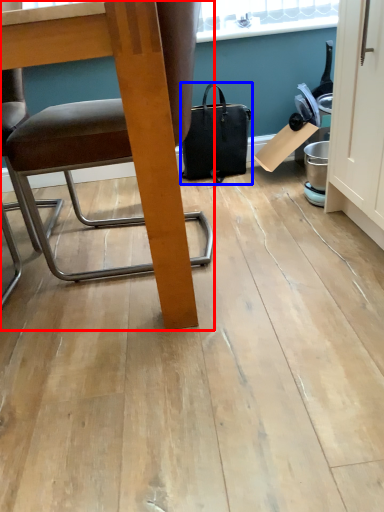
Question: Among these objects, which one is nearest to the camera, chair (highlighted by a red box) or handbag (highlighted by a blue box)?

Choices:
 (A) chair
 (B) handbag

Answer: (A)